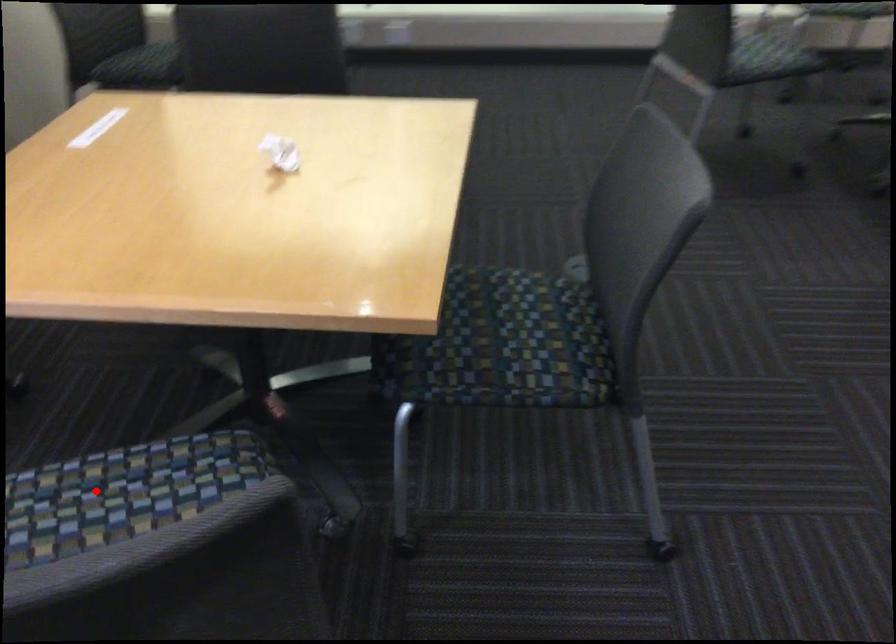
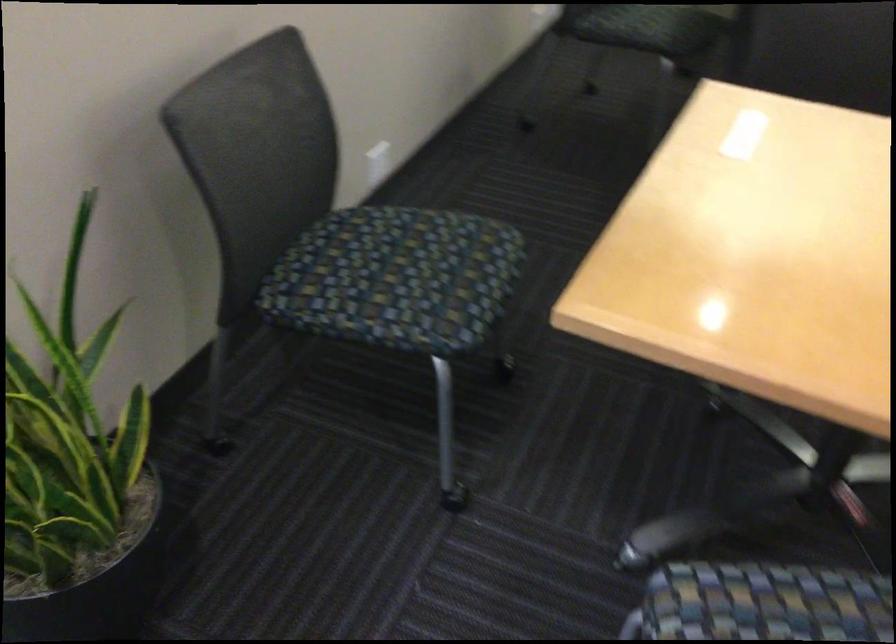
Question: I am providing you with two images of the same scene from different viewpoints. Given a red point in image1, look at the same physical point in image2. Is it:

Choices:
 (A) Closer to the viewpoint
 (B) Farther from the viewpoint

Answer: (A)